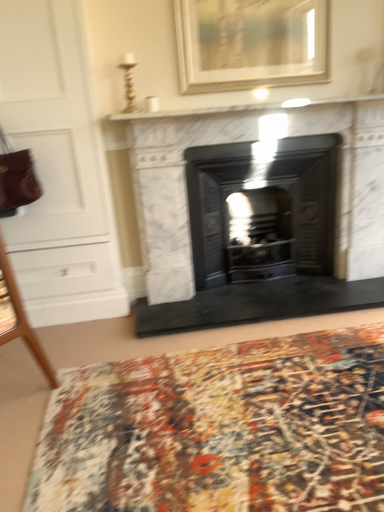
Question: From their relative heights in the image, would you say multicolored woven mat at lower center is taller or shorter than white marble shelf at upper center?

Choices:
 (A) tall
 (B) short

Answer: (B)

Question: Which is correct: multicolored woven mat at lower center is inside white marble shelf at upper center, or outside of it?

Choices:
 (A) inside
 (B) outside

Answer: (B)

Question: Which is nearer to the multicolored woven mat at lower center?

Choices:
 (A) gold/wooden picture frame at upper center
 (B) white glossy dresser at left
 (C) white marble shelf at upper center
 (D) white marble fireplace at center
 (E) matte black wood burning stove at center

Answer: (D)

Question: Considering the real-world distances, which object is farthest from the gold/wooden picture frame at upper center?

Choices:
 (A) multicolored woven mat at lower center
 (B) multicolored woven rug at center
 (C) matte black wood burning stove at center
 (D) white marble fireplace at center
 (E) white glossy dresser at left

Answer: (A)